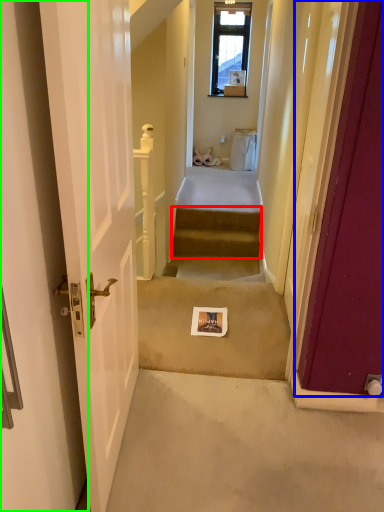
Question: Based on their relative distances, which object is farther from stairs (highlighted by a red box)? Choose from door (highlighted by a blue box) and door (highlighted by a green box).

Choices:
 (A) door
 (B) door

Answer: (B)